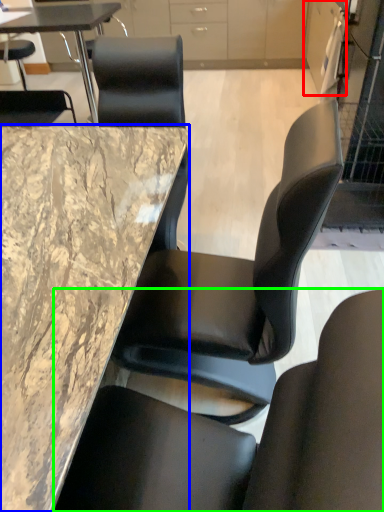
Question: Estimate the real-world distances between objects in this image. Which object is closer to cabinetry (highlighted by a red box), table (highlighted by a blue box) or chair (highlighted by a green box)?

Choices:
 (A) table
 (B) chair

Answer: (A)